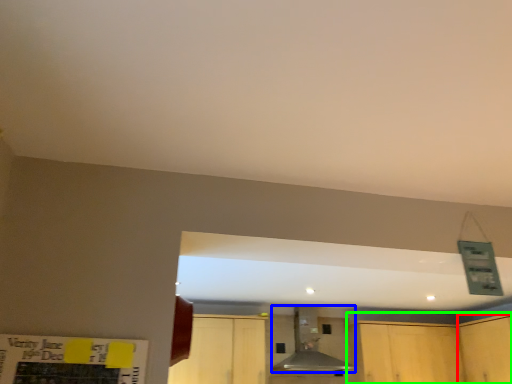
Question: Estimate the real-world distances between objects in this image. Which object is closer to cabinetry (highlighted by a red box), vent (highlighted by a blue box) or cabinetry (highlighted by a green box)?

Choices:
 (A) vent
 (B) cabinetry

Answer: (B)